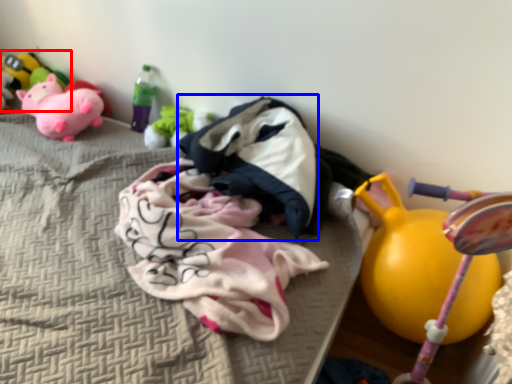
Question: Among these objects, which one is farthest to the camera, toy (highlighted by a red box) or clothing (highlighted by a blue box)?

Choices:
 (A) toy
 (B) clothing

Answer: (A)